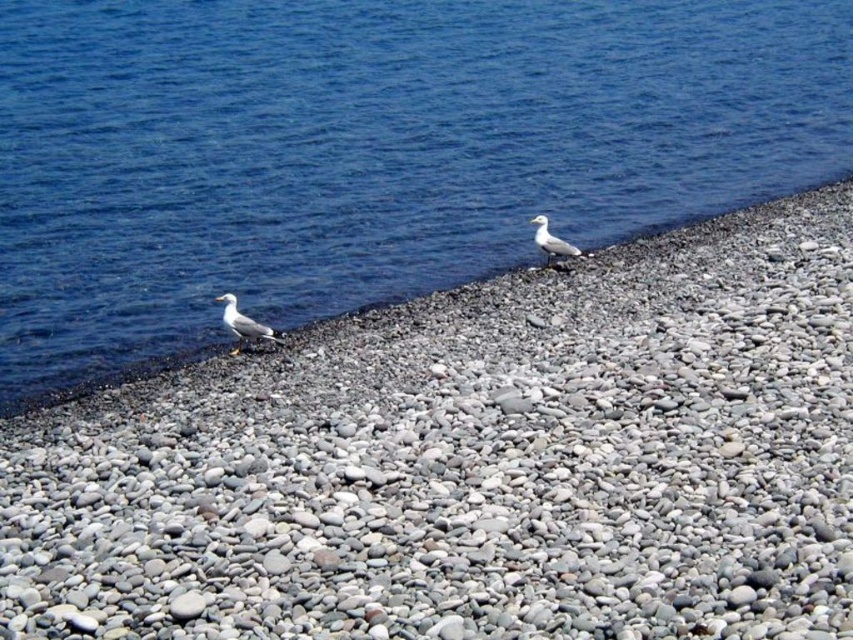
Can you confirm if gray pebbles at center is taller than white feathered bird at center?

Yes.

Can you confirm if gray pebbles at center is positioned below white feathered bird at center?

Correct, gray pebbles at center is located below white feathered bird at center.

Identify the location of gray pebbles at center. (474, 461).

Between blue water at upper left and white matte seagull at lower left, which one is positioned higher?

Positioned higher is blue water at upper left.

Does point (224, 228) come in front of point (222, 296)?

No, it is behind (222, 296).

Locate an element on the screen. blue water at upper left is located at coordinates (367, 152).

Is gray pebbles at center behind blue water at upper left?

No, it is not.

Looking at this image, is gray pebbles at center taller than blue water at upper left?

No.

Describe the element at coordinates (474, 461) in the screenshot. I see `gray pebbles at center` at that location.

The width and height of the screenshot is (853, 640). In order to click on gray pebbles at center in this screenshot , I will do `click(474, 461)`.